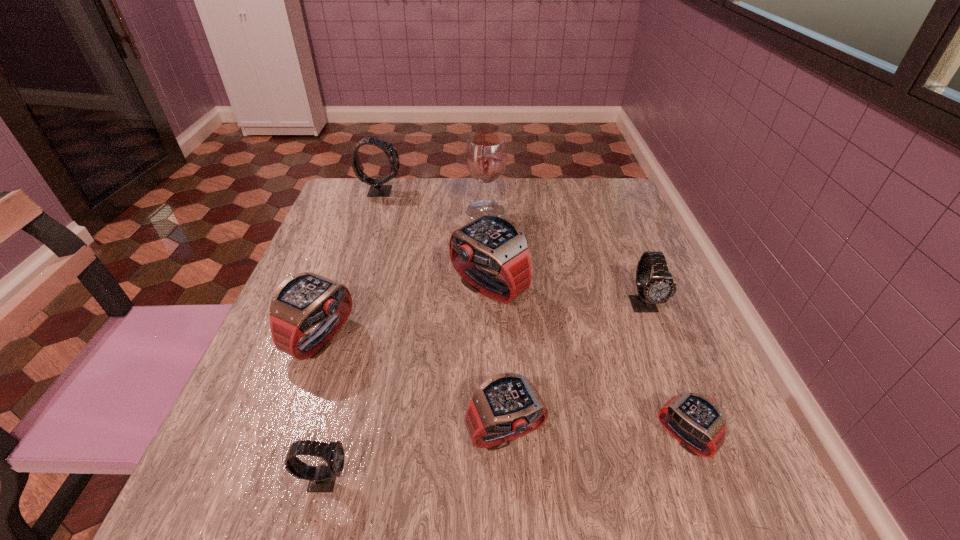
Where is `the tallest object`? The width and height of the screenshot is (960, 540). the tallest object is located at coordinates (486, 155).

This screenshot has height=540, width=960. What are the coordinates of `the second farthest object` in the screenshot? It's located at (486, 155).

Where is `the biggest gray watch`? the biggest gray watch is located at coordinates [x=377, y=189].

At what (x,y) coordinates should I click in order to perform the action: click on the farthest gray watch. Please return your answer as a coordinate pair (x, y). The width and height of the screenshot is (960, 540). Looking at the image, I should click on (377, 189).

Locate an element on the screen. This screenshot has width=960, height=540. the biggest red watch is located at coordinates (494, 242).

Identify the location of the third smallest red watch. Image resolution: width=960 pixels, height=540 pixels. [x=302, y=301].

What are the coordinates of `the second nearest gray watch` in the screenshot? It's located at (660, 288).

Identify the location of the second biggest gray watch. (660, 288).

This screenshot has width=960, height=540. Find the location of `the third biggest red watch`. the third biggest red watch is located at coordinates (506, 406).

You are a GUI agent. You are given a task and a screenshot of the screen. Output one action in this format:
    pyautogui.click(x=<x>, y=<y>)
    Task: Click on the smallest gray watch
    The height and width of the screenshot is (540, 960).
    Given the screenshot: What is the action you would take?
    pyautogui.click(x=322, y=478)